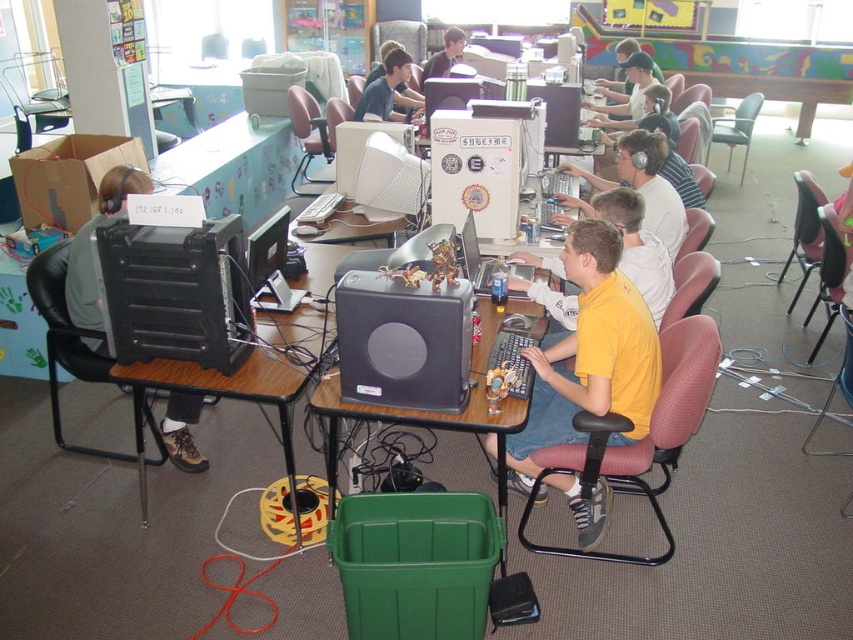
You are standing in the computer lab and need to reach both the point at coordinates (618,374) and the point at (254,269). Which point will you reach first if you move forward in a straight line?

You will reach the point at coordinates (618,374) first because it is closer to you than the point at (254,269).

You are a student sitting at a desk in the computer lab. You notice the yellow matte shirt at center and the matte black monitor at center. Which object is positioned lower in relation to the other?

The yellow matte shirt at center is located below the matte black monitor at center, so it is positioned lower than the monitor.